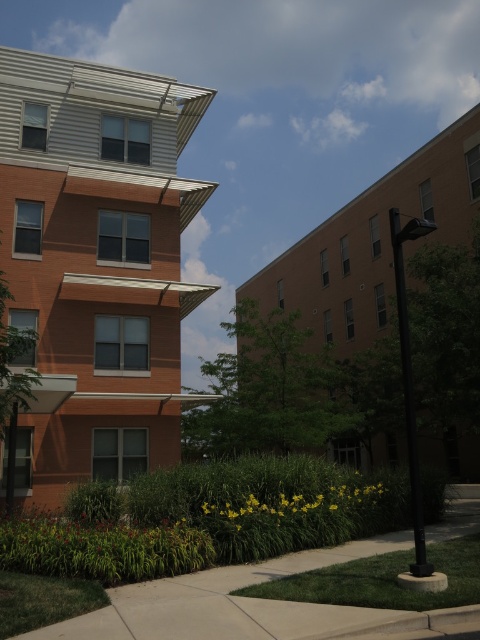
You are standing at the center of the image. Which direction should you look to see the orange brick building at left?

The orange brick building at left is located at point (96, 262), so you should look to the left to see it.

You are a delivery person standing on the concrete sidewalk at lower center and need to deliver a package to the orange brick building at left. Which direction should you walk to reach the building?

The orange brick building at left is located above the concrete sidewalk at lower center, so you should walk forward towards the building since it is positioned above the sidewalk in the scene.